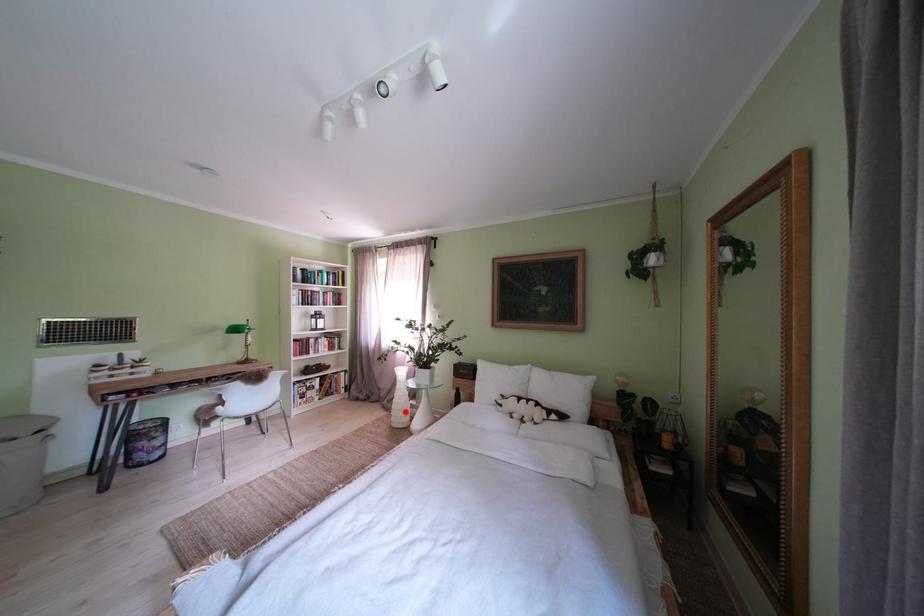
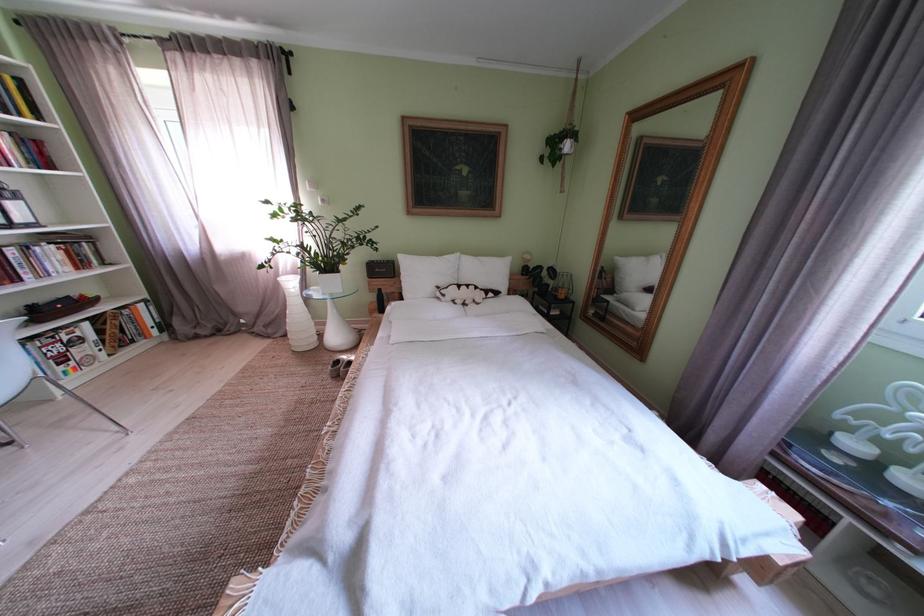
Question: I am providing you with two images of the same scene from different viewpoints. In image1, a red point is highlighted. Considering the same 3D point in image2, which of the following is correct?

Choices:
 (A) It is closer
 (B) It is farther

Answer: (A)